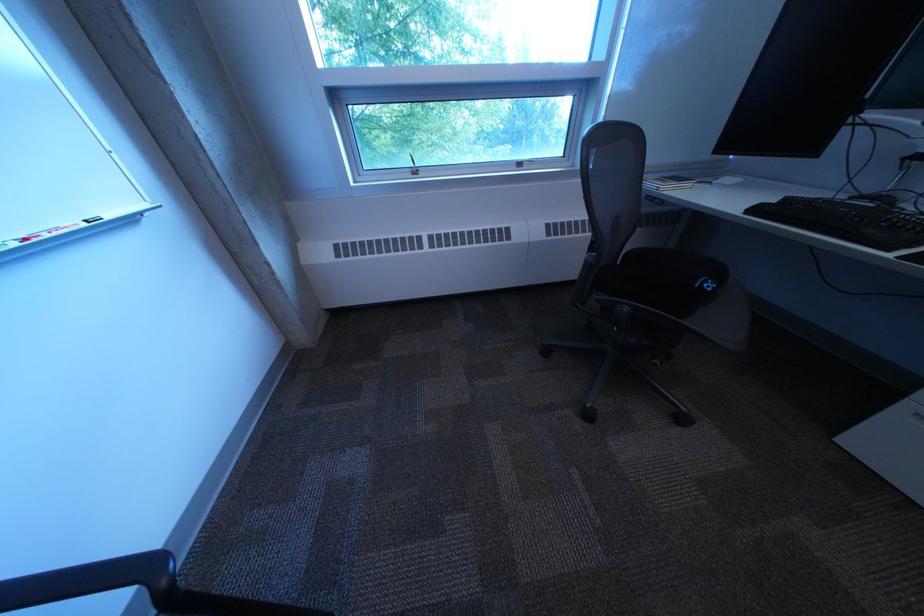
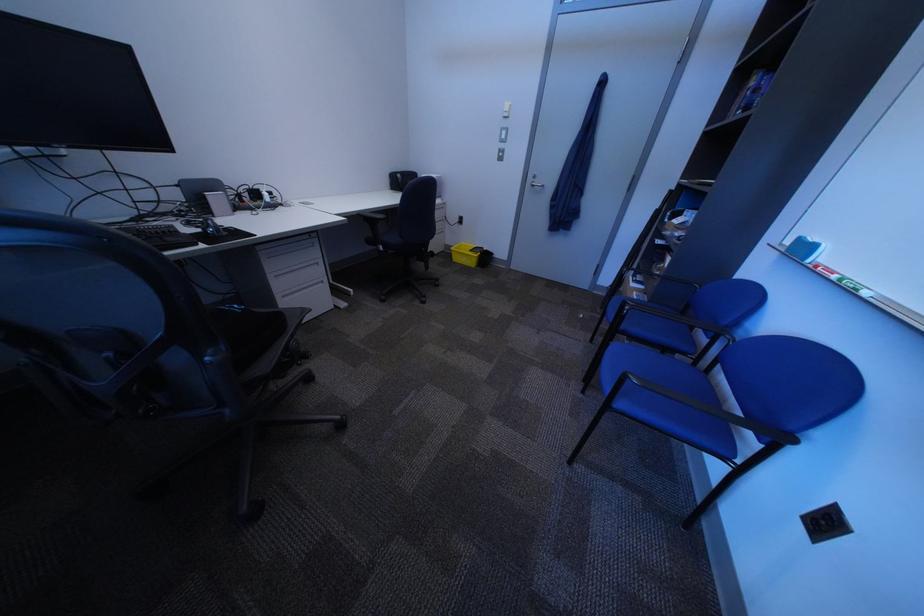
Find the pixel in the second image that matches pixel 724 292 in the first image.

(259, 309)